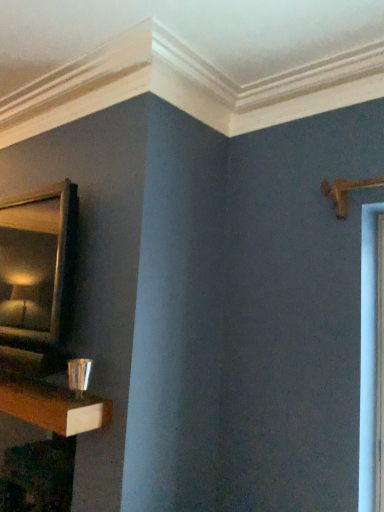
Question: Is gold-framed mirror at upper left closer to camera compared to shiny metallic cup at lower left?

Choices:
 (A) yes
 (B) no

Answer: (B)

Question: From the image's perspective, is gold-framed mirror at upper left under shiny metallic cup at lower left?

Choices:
 (A) yes
 (B) no

Answer: (B)

Question: Is gold-framed mirror at upper left smaller than shiny metallic cup at lower left?

Choices:
 (A) no
 (B) yes

Answer: (A)

Question: Can you confirm if gold-framed mirror at upper left is bigger than shiny metallic cup at lower left?

Choices:
 (A) yes
 (B) no

Answer: (A)

Question: Considering the relative sizes of gold-framed mirror at upper left and shiny metallic cup at lower left in the image provided, is gold-framed mirror at upper left taller than shiny metallic cup at lower left?

Choices:
 (A) yes
 (B) no

Answer: (A)

Question: From their relative heights in the image, would you say shiny metallic cup at lower left is taller or shorter than wooden table at lower left?

Choices:
 (A) short
 (B) tall

Answer: (A)

Question: From the image's perspective, is shiny metallic cup at lower left above or below wooden table at lower left?

Choices:
 (A) above
 (B) below

Answer: (A)

Question: Considering the positions of point (92, 399) and point (24, 390), is point (92, 399) closer or farther from the camera than point (24, 390)?

Choices:
 (A) closer
 (B) farther

Answer: (A)

Question: Relative to wooden table at lower left, is shiny metallic cup at lower left in front or behind?

Choices:
 (A) front
 (B) behind

Answer: (A)

Question: From the image's perspective, relative to gold-framed mirror at upper left, is wooden table at lower left above or below?

Choices:
 (A) above
 (B) below

Answer: (B)

Question: Would you say wooden table at lower left is inside or outside gold-framed mirror at upper left?

Choices:
 (A) inside
 (B) outside

Answer: (B)

Question: In the image, is wooden table at lower left positioned in front of or behind gold-framed mirror at upper left?

Choices:
 (A) behind
 (B) front

Answer: (A)

Question: Is point (77, 401) positioned closer to the camera than point (39, 303)?

Choices:
 (A) closer
 (B) farther

Answer: (A)

Question: From their relative heights in the image, would you say wooden table at lower left is taller or shorter than shiny metallic cup at lower left?

Choices:
 (A) short
 (B) tall

Answer: (B)

Question: Considering the positions of point (56, 494) and point (33, 381), is point (56, 494) closer or farther from the camera than point (33, 381)?

Choices:
 (A) farther
 (B) closer

Answer: (A)